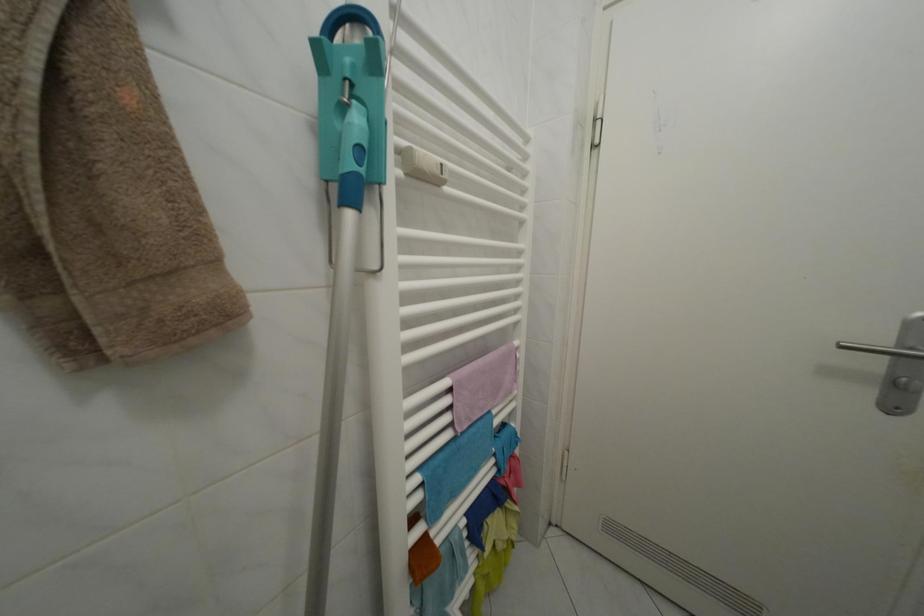
Identify the location of radiator thermostat. (422, 166).